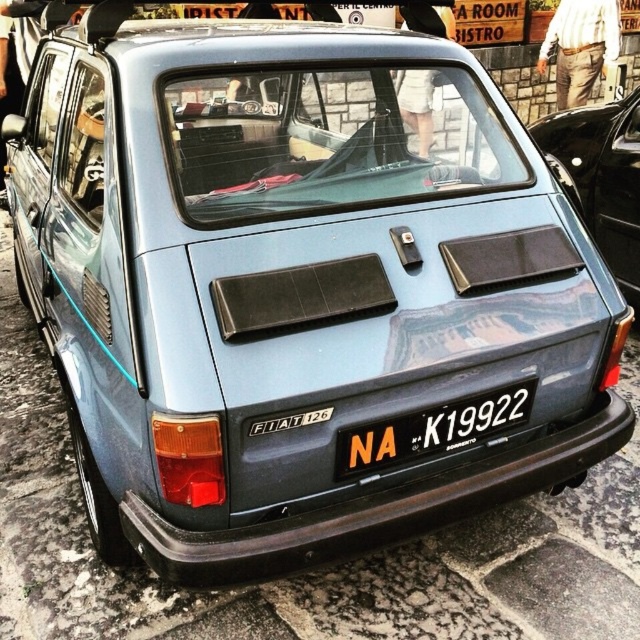
Can you confirm if metallic blue car at center is thinner than white plastic license plate at center?

Correct, metallic blue car at center's width is less than white plastic license plate at center's.

Between metallic blue car at center and white plastic license plate at center, which one is positioned higher?

Positioned higher is metallic blue car at center.

Between point (630, 218) and point (518, 412), which one is positioned behind?

The point (630, 218) is behind.

Where is `metallic blue car at center`? The image size is (640, 640). metallic blue car at center is located at coordinates (604, 177).